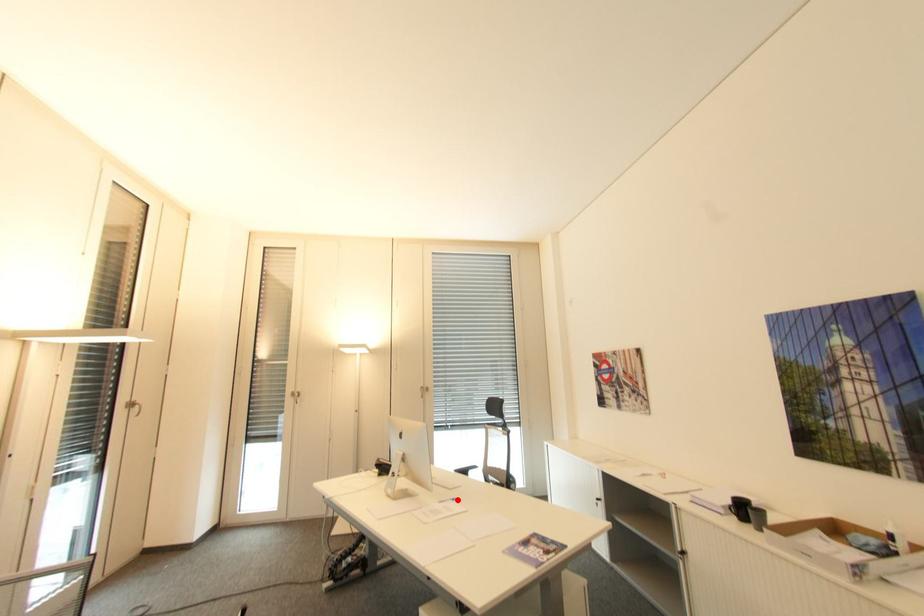
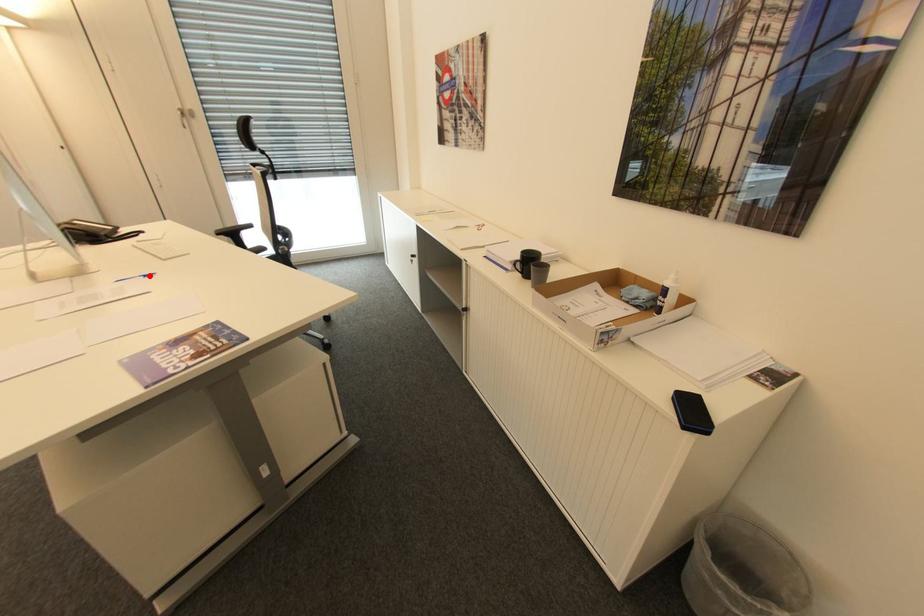
Consider the image. I am providing you with two images of the same scene from different viewpoints. A red point is marked on the first image and another point is marked on the second image. Is the marked point in image1 the same physical position as the marked point in image2?

Yes